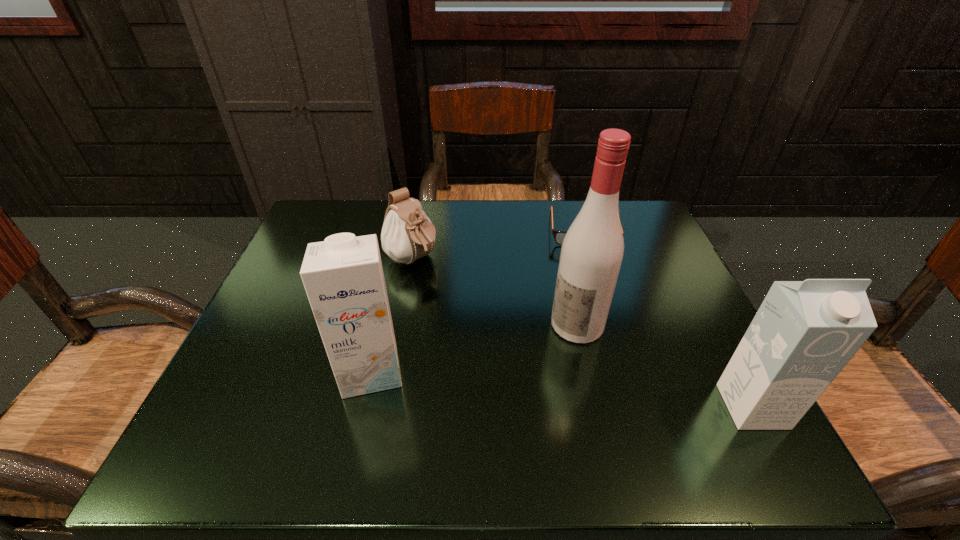
This screenshot has width=960, height=540. Identify the location of object that is at the near right corner. (804, 333).

Image resolution: width=960 pixels, height=540 pixels. Identify the location of free spot at the far edge of the desktop. (516, 219).

Where is `vacant space at the near edge`? The image size is (960, 540). vacant space at the near edge is located at coordinates (548, 387).

What are the coordinates of `free region at the right edge of the desktop` in the screenshot? It's located at coord(662,269).

This screenshot has width=960, height=540. In the image, there is a desktop. What are the coordinates of `vacant space at the far left corner` in the screenshot? It's located at (374, 205).

Where is `free space at the near left corner of the desktop`? The image size is (960, 540). free space at the near left corner of the desktop is located at coordinates (293, 388).

At what (x,y) coordinates should I click in order to perform the action: click on empty location between the right carton and the tallest object. Please return your answer as a coordinate pair (x, y). This screenshot has height=540, width=960. Looking at the image, I should click on (665, 366).

The image size is (960, 540). I want to click on vacant area between the left carton and the alcohol, so click(x=474, y=347).

Identify the location of free space between the left carton and the rightmost object. (562, 388).

This screenshot has width=960, height=540. I want to click on blank region between the tallest object and the right carton, so click(665, 366).